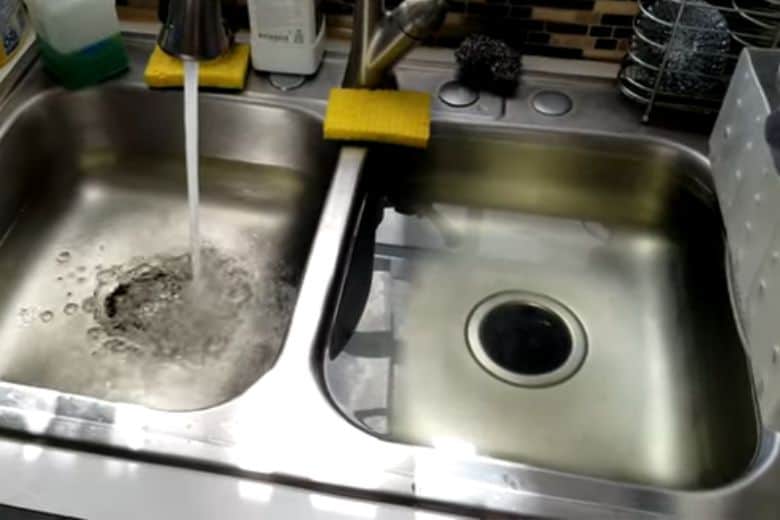
This screenshot has width=780, height=520. Find the location of `long rectangular plastic box`. long rectangular plastic box is located at coordinates (759, 169).